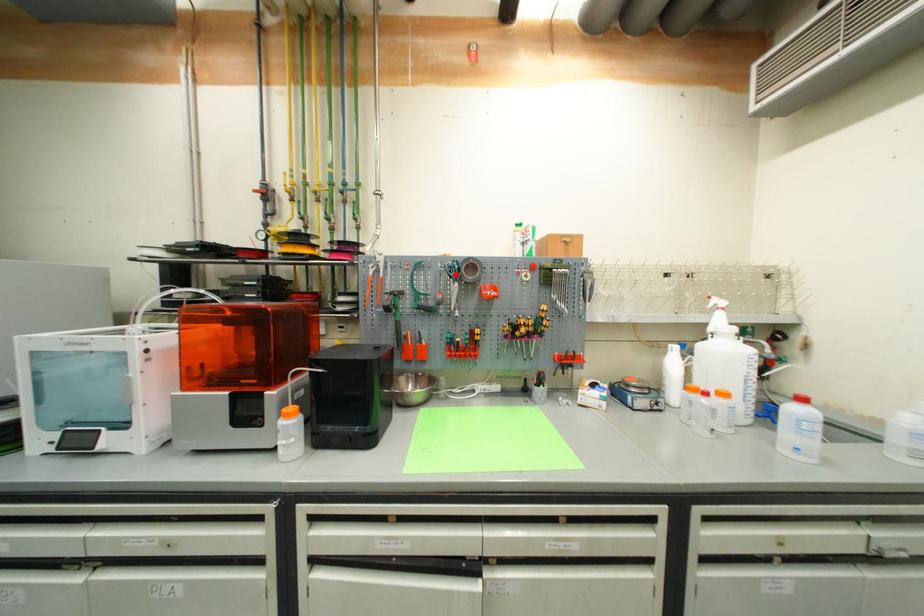
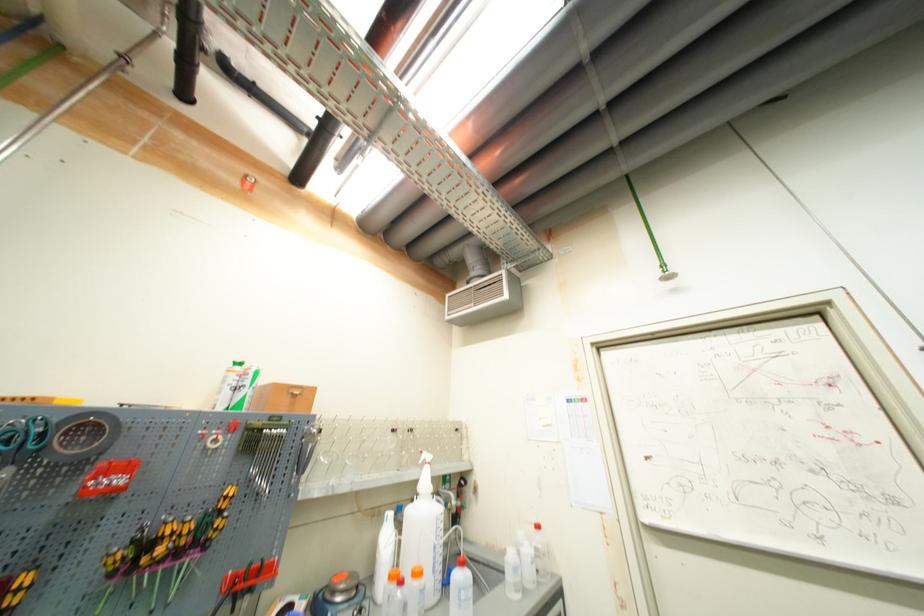
Locate, in the second image, the point that corresponds to the highlighted location in the first image.

(14, 445)